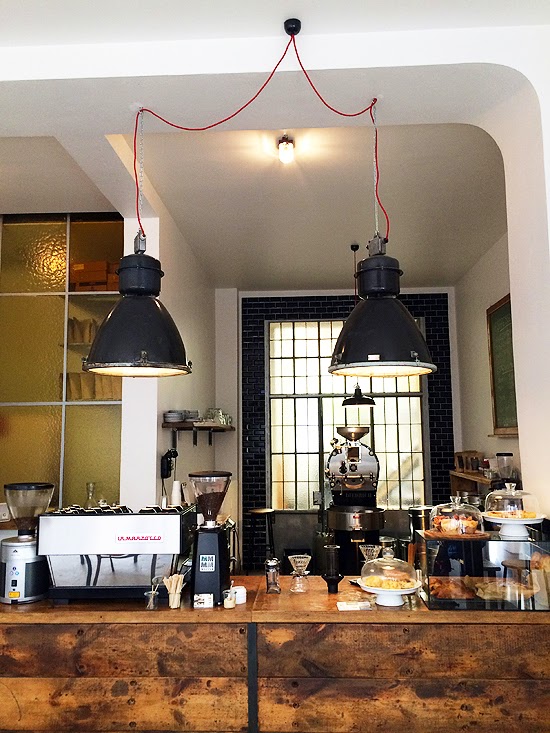
Where is `blender`? The height and width of the screenshot is (733, 550). blender is located at coordinates (209, 503).